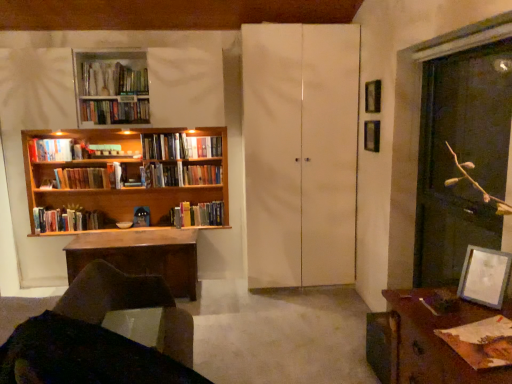
Question: Is matte white picture frame at lower right, arranged as the 1th picture frame when ordered from the bottom, at the back of transparent glass screen door at right, marked as the second screen door in a back-to-front arrangement?

Choices:
 (A) yes
 (B) no

Answer: (B)

Question: Is transparent glass screen door at right, marked as the second screen door in a back-to-front arrangement, shorter than matte white picture frame at lower right, the third picture frame in the back-to-front sequence?

Choices:
 (A) yes
 (B) no

Answer: (B)

Question: Is transparent glass screen door at right, marked as the second screen door in a back-to-front arrangement, wider than matte white picture frame at lower right, the third picture frame in the back-to-front sequence?

Choices:
 (A) yes
 (B) no

Answer: (A)

Question: Is matte white picture frame at lower right, which is the 1th picture frame in front-to-back order, located within transparent glass screen door at right, placed as the first screen door when sorted from front to back?

Choices:
 (A) yes
 (B) no

Answer: (B)

Question: From a real-world perspective, is transparent glass screen door at right, which ranks as the 2th screen door in left-to-right order, under matte white picture frame at lower right, which is the 1th picture frame in front-to-back order?

Choices:
 (A) yes
 (B) no

Answer: (B)

Question: Does transparent glass screen door at right, placed as the first screen door when sorted from front to back, lie behind matte white picture frame at lower right, arranged as the 1th picture frame when ordered from the bottom?

Choices:
 (A) yes
 (B) no

Answer: (A)

Question: Can we say metallic silver picture frame at upper right, placed as the 2th picture frame when sorted from front to back, lies outside hardcover books at upper left, which is the 7th book in back-to-front order?

Choices:
 (A) no
 (B) yes

Answer: (B)

Question: Is metallic silver picture frame at upper right, the second picture frame in the back-to-front sequence, with hardcover books at upper left, which is the 7th book in back-to-front order?

Choices:
 (A) yes
 (B) no

Answer: (B)

Question: Does metallic silver picture frame at upper right, placed as the 2th picture frame when sorted from front to back, have a greater height compared to hardcover books at upper left, marked as the third book in a front-to-back arrangement?

Choices:
 (A) yes
 (B) no

Answer: (A)

Question: Is there a large distance between metallic silver picture frame at upper right, placed as the 2th picture frame when sorted from front to back, and hardcover books at upper left, which is the 7th book in back-to-front order?

Choices:
 (A) no
 (B) yes

Answer: (B)

Question: Does metallic silver picture frame at upper right, placed as the 2th picture frame when sorted from front to back, have a smaller size compared to hardcover books at upper left, marked as the third book in a front-to-back arrangement?

Choices:
 (A) yes
 (B) no

Answer: (A)

Question: Is the depth of metallic silver picture frame at upper right, acting as the first picture frame starting from the top, less than that of hardcover books at upper left, marked as the third book in a front-to-back arrangement?

Choices:
 (A) no
 (B) yes

Answer: (B)

Question: Can you confirm if brown wooden desk at lower right is wider than wooden bookcase at left?

Choices:
 (A) yes
 (B) no

Answer: (A)